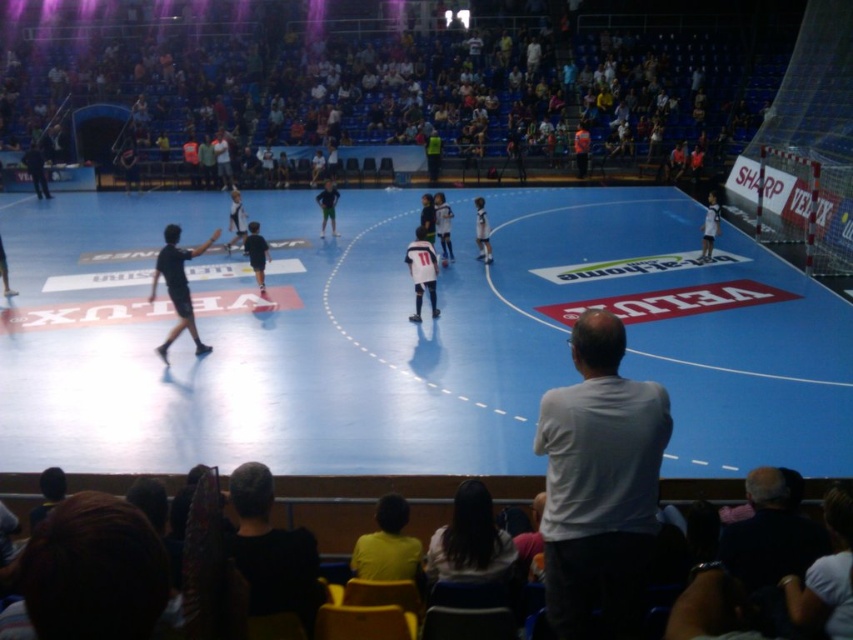
Looking at this image, you are a futsal player positioned at the point labeled as point (387, 540). You need to pass the ball to your teammate located at point (630, 474). Considering your position and the direction of the pass, is the teammate ahead of you or behind you in terms of the court layout?

The teammate at point (630, 474) is ahead of you because point (630, 474) is in front of point (387, 540) according to the court layout.

Based on the photo, you are a photographer standing at the back of the arena. You want to take a photo that includes both the blue rubber basketball court at center and the black matte shirt at left. Which object should you adjust your camera angle to focus on first to ensure both are in frame?

The blue rubber basketball court at center is much taller than the black matte shirt at left, so you should focus on the blue rubber basketball court at center first to ensure both are in frame.

You are a photographer standing at the edge of the futsal court. You want to take a photo that includes both the yellow shirt at lower center and the white jersey at center. Which of these shirts will appear smaller in the photo?

The yellow shirt at lower center will appear smaller in the photo because it has a lesser width compared to the white jersey at center.